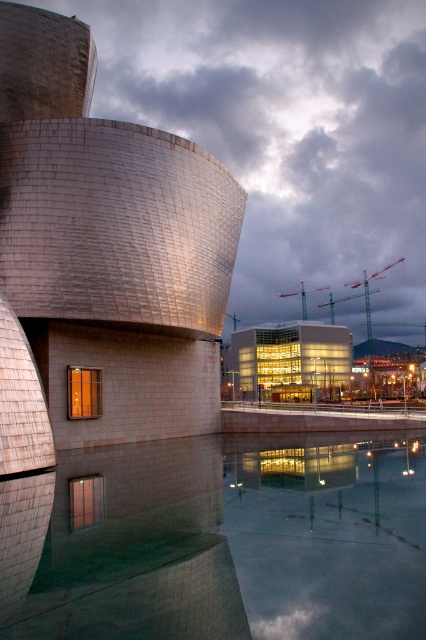
Does point (386, 492) come behind point (368, 348)?

No, (386, 492) is closer to viewer.

I want to click on reflective glass water at lower center, so click(x=328, y=538).

Which of these two, reflective glass water at lower center or glass modern building at center, stands taller?

With more height is glass modern building at center.

Does reflective glass water at lower center appear under glass modern building at center?

Correct, reflective glass water at lower center is located below glass modern building at center.

Find the location of a particular element. Image resolution: width=426 pixels, height=640 pixels. reflective glass water at lower center is located at coordinates (328, 538).

Image resolution: width=426 pixels, height=640 pixels. I want to click on reflective glass water at lower center, so click(x=328, y=538).

Looking at this image, can you confirm if reflective glass water at lower center is positioned above transparent glass building at center?

Correct, reflective glass water at lower center is located above transparent glass building at center.

Does reflective glass water at lower center have a lesser width compared to transparent glass building at center?

Yes, reflective glass water at lower center is thinner than transparent glass building at center.

Who is more distant from viewer, [402,579] or [411,442]?

The point [411,442] is behind.

Where is `reflective glass water at lower center`? reflective glass water at lower center is located at coordinates (328, 538).